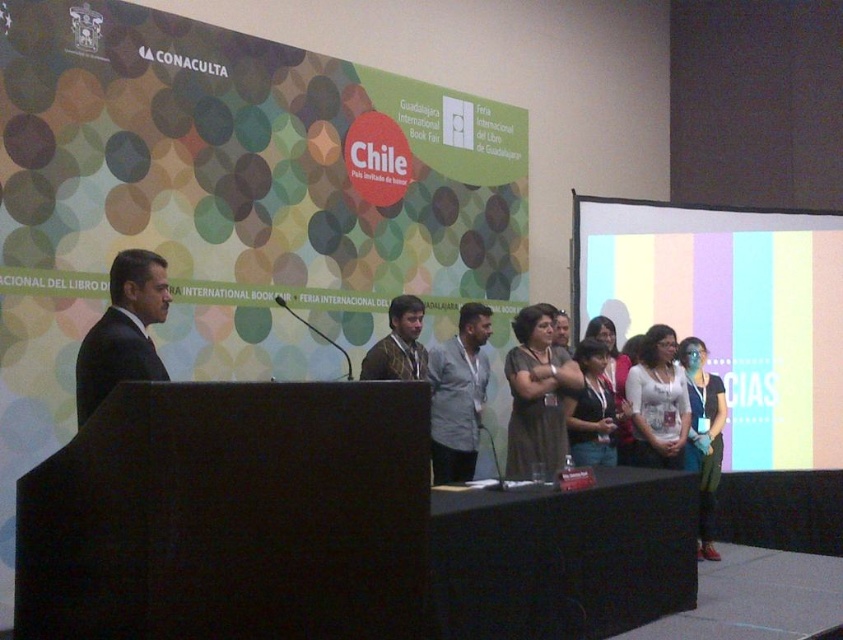
You are attending the Guadalajara International Book Fair and notice two items at the center of the stage. The white matte blouse at center and the shiny brown suit at center. Which item is taller?

The white matte blouse at center is much taller than the shiny brown suit at center.

You are an attendee at the event and want to know which object is taller between the pastel striped fabric at right and the black suit at left. Can you determine this based on their positions?

The pastel striped fabric at right has a greater height compared to the black suit at left, so the pastel striped fabric at right is taller.

You are attending the Guadalajara International Book Fair and notice two items in the scene. One is the pastel striped fabric at right and the other is the black suit at left. Which item is positioned closer to the front of the scene?

The pastel striped fabric at right is closer to the front of the scene because the black suit at left is behind it.